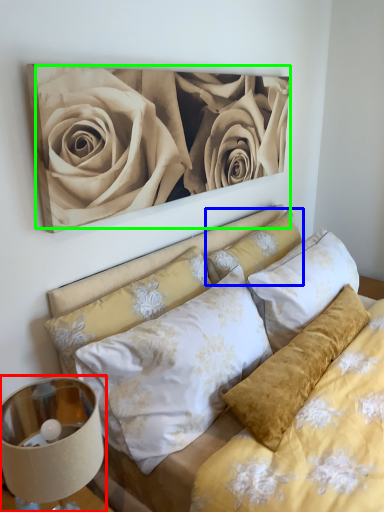
Question: Which is nearer to the lamp (highlighted by a red box)? pillow (highlighted by a blue box) or rose (highlighted by a green box).

Choices:
 (A) pillow
 (B) rose

Answer: (B)